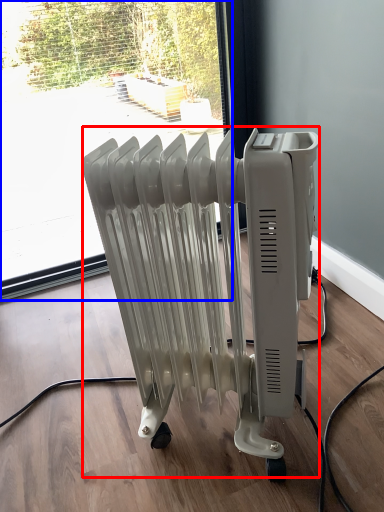
Question: Which object is closer to the camera taking this photo, bath heater (highlighted by a red box) or window (highlighted by a blue box)?

Choices:
 (A) bath heater
 (B) window

Answer: (A)